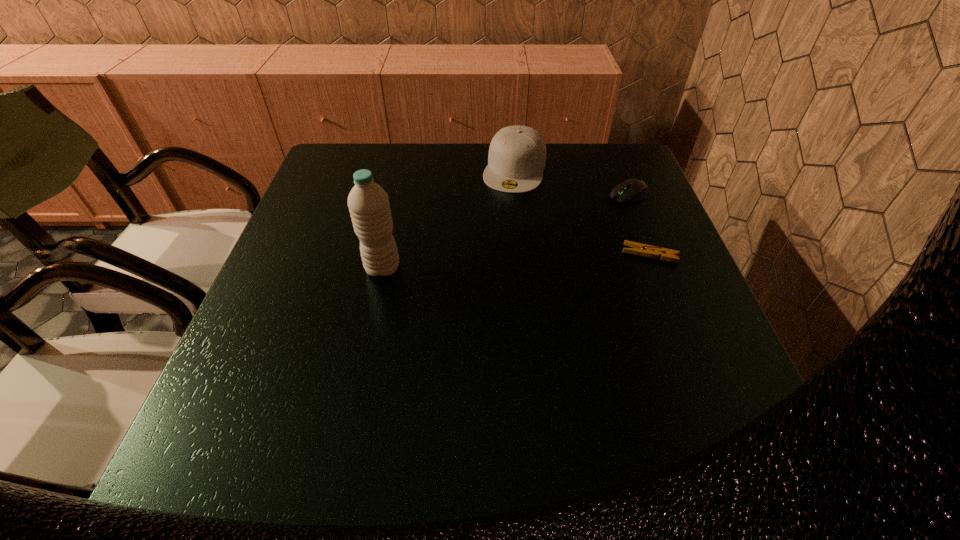
Where is `free space on the desktop that is between the leftmost object and the clothespin and is positioned on the front-facing side of the third object from right to left`? This screenshot has height=540, width=960. free space on the desktop that is between the leftmost object and the clothespin and is positioned on the front-facing side of the third object from right to left is located at coordinates (484, 263).

Image resolution: width=960 pixels, height=540 pixels. In order to click on vacant spot on the desktop that is between the leftmost object and the clothespin and is positioned on the wheel side of the second shortest object in this screenshot , I will do `click(489, 262)`.